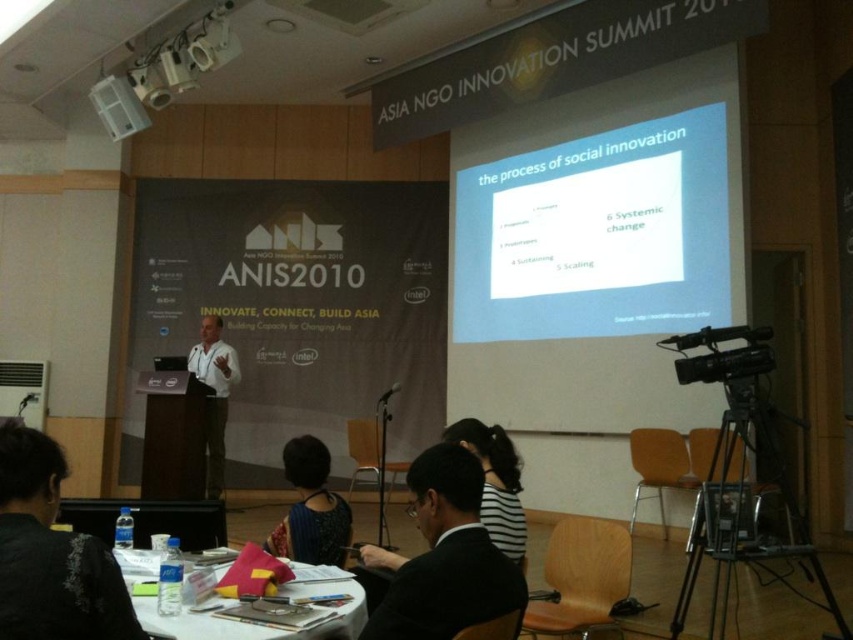
Which is more to the left, black fabric shirt at lower left or dark blue fabric dress at center?

black fabric shirt at lower left

Does black fabric shirt at lower left have a smaller size compared to dark blue fabric dress at center?

No.

Does point (119, 600) lie behind point (281, 540)?

No, it is not.

Locate an element on the screen. The width and height of the screenshot is (853, 640). black fabric shirt at lower left is located at coordinates (51, 554).

Who is more forward, (579, 225) or (383, 392)?

Positioned in front is point (579, 225).

Is white matte projector screen at upper center thinner than black matte microphone at center?

No.

Which is in front, point (663, 118) or point (397, 385)?

Positioned in front is point (663, 118).

Where is `white matte projector screen at upper center`? white matte projector screen at upper center is located at coordinates (596, 234).

Is black suit at center to the left of white shirt at center from the viewer's perspective?

Incorrect, black suit at center is not on the left side of white shirt at center.

Is black suit at center above white shirt at center?

Correct, black suit at center is located above white shirt at center.

The width and height of the screenshot is (853, 640). In order to click on black suit at center in this screenshot , I will do `click(444, 556)`.

Identify the location of black suit at center. The width and height of the screenshot is (853, 640). (444, 556).